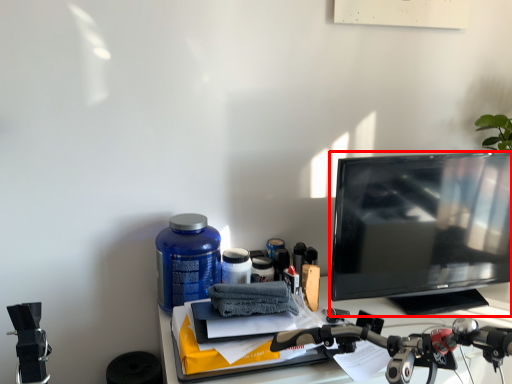
Question: Observing the image, what is the correct spatial positioning of television (annotated by the red box) in reference to bottle?

Choices:
 (A) right
 (B) left

Answer: (A)